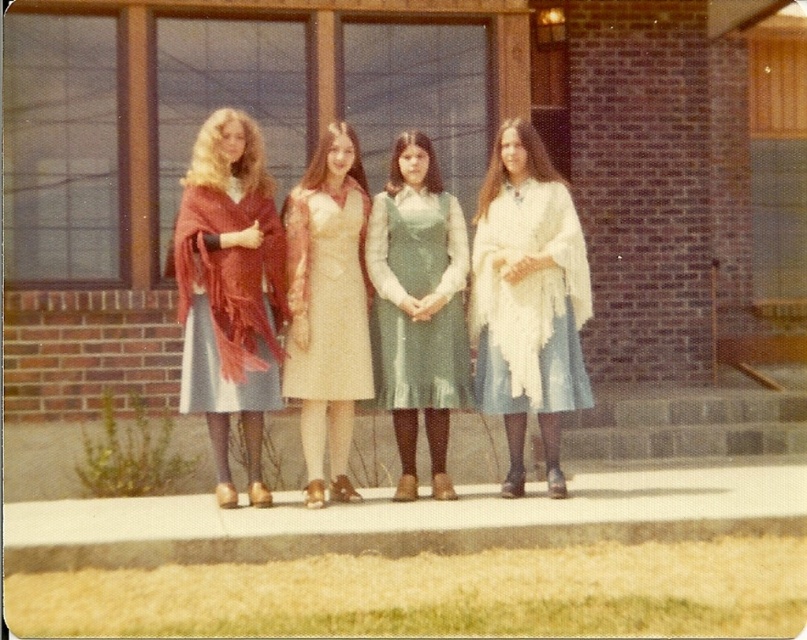
Question: Can you confirm if green satin dress at center is positioned below satin beige dress at center?

Choices:
 (A) no
 (B) yes

Answer: (B)

Question: Can you confirm if white fringed shawl at right is positioned above satin beige dress at center?

Choices:
 (A) yes
 (B) no

Answer: (B)

Question: Which object is the closest to the white fringed shawl at right?

Choices:
 (A) matte red shawl at left
 (B) green satin dress at center

Answer: (B)

Question: Which object is the closest to the matte red shawl at left?

Choices:
 (A) satin beige dress at center
 (B) white fringed shawl at right
 (C) green satin dress at center

Answer: (A)

Question: Considering the real-world distances, which object is closest to the matte red shawl at left?

Choices:
 (A) satin beige dress at center
 (B) white fringed shawl at right
 (C) green satin dress at center

Answer: (A)

Question: Can you confirm if matte red shawl at left is positioned above green satin dress at center?

Choices:
 (A) no
 (B) yes

Answer: (A)